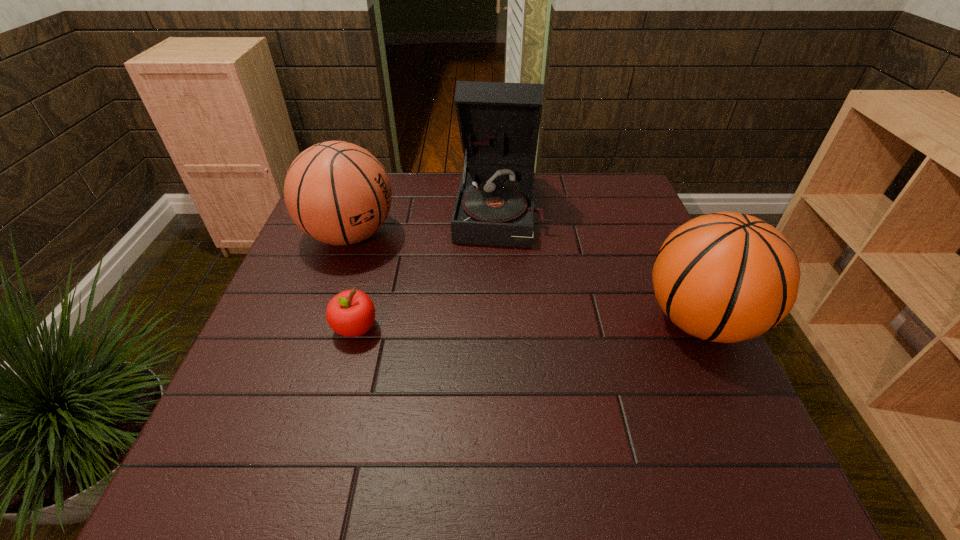
Image resolution: width=960 pixels, height=540 pixels. In order to click on free area in between the shortest object and the rightmost object in this screenshot , I will do `click(528, 324)`.

Locate an element on the screen. unoccupied area between the phonograph_record and the nearer basketball is located at coordinates (601, 264).

Where is `unoccupied area between the shortest object and the farther basketball`? The image size is (960, 540). unoccupied area between the shortest object and the farther basketball is located at coordinates (352, 281).

Find the location of `vacant area that lies between the right basketball and the left basketball`. vacant area that lies between the right basketball and the left basketball is located at coordinates (525, 278).

Where is `vacant space in between the nearer basketball and the farther basketball`? The height and width of the screenshot is (540, 960). vacant space in between the nearer basketball and the farther basketball is located at coordinates (525, 278).

Locate an element on the screen. Image resolution: width=960 pixels, height=540 pixels. object that is the closest to the left basketball is located at coordinates pyautogui.click(x=499, y=123).

Select which object appears as the third closest to the nearer basketball. Please provide its 2D coordinates. Your answer should be formatted as a tuple, i.e. [(x, y)], where the tuple contains the x and y coordinates of a point satisfying the conditions above.

[(338, 193)]